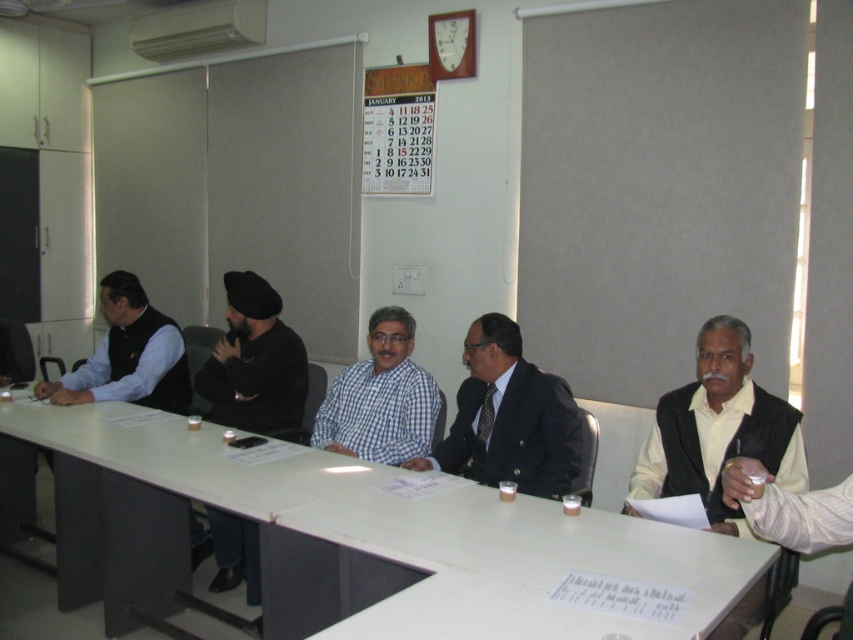
Is matte black vest at left above white paper calendar at upper center?

Actually, matte black vest at left is below white paper calendar at upper center.

Which of these two, matte black vest at left or white paper calendar at upper center, stands taller?

Standing taller between the two is white paper calendar at upper center.

Locate an element on the screen. matte black vest at left is located at coordinates (128, 355).

This screenshot has height=640, width=853. I want to click on matte black vest at left, so click(128, 355).

Which is behind, point (375, 339) or point (149, 397)?

Point (149, 397)

Locate an element on the screen. The height and width of the screenshot is (640, 853). blue checkered shirt at center is located at coordinates (380, 397).

Where is `blue checkered shirt at center`? This screenshot has height=640, width=853. blue checkered shirt at center is located at coordinates (380, 397).

Can you confirm if white plastic table at center is taller than matte black vest at left?

Yes.

Is white plastic table at center shorter than matte black vest at left?

No.

Who is more forward, (566,547) or (86,362)?

Positioned in front is point (566,547).

This screenshot has width=853, height=640. I want to click on white plastic table at center, so click(x=358, y=531).